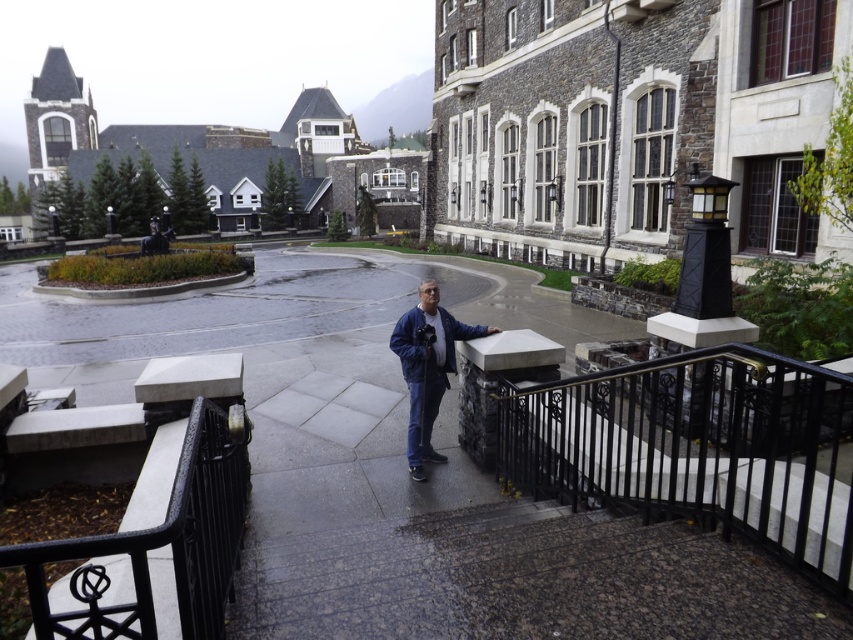
Question: Estimate the real-world distances between objects in this image. Which object is closer to the black wrought iron at center?

Choices:
 (A) gray polished stone pavement at center
 (B) blue matte jacket at center

Answer: (B)

Question: Can you confirm if gray polished stone pavement at center is positioned below blue matte jacket at center?

Choices:
 (A) no
 (B) yes

Answer: (A)

Question: Which object is positioned farthest from the blue matte jacket at center?

Choices:
 (A) black wrought iron railing at center
 (B) gray polished stone pavement at center
 (C) black wrought iron at center
 (D) blue denim jacket at center

Answer: (B)

Question: Can you confirm if gray polished stone pavement at center is positioned above black wrought iron at center?

Choices:
 (A) no
 (B) yes

Answer: (B)

Question: Is gray polished stone pavement at center above blue denim jacket at center?

Choices:
 (A) no
 (B) yes

Answer: (B)

Question: Among these objects, which one is farthest from the camera?

Choices:
 (A) blue denim jacket at center
 (B) black wrought iron at center
 (C) black wrought iron railing at center
 (D) gray polished stone pavement at center

Answer: (A)